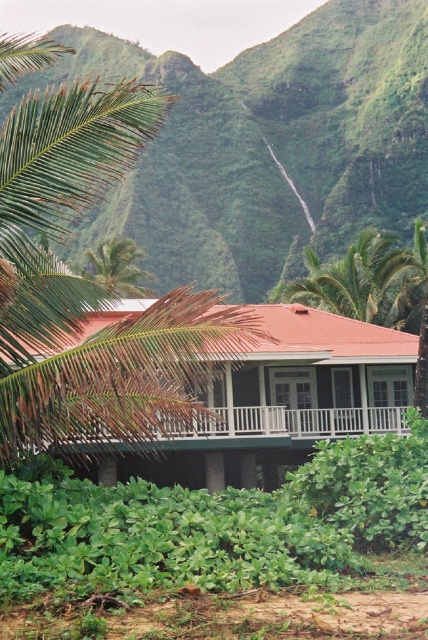
Who is higher up, green wooden house at center or white wooden porch at center?

green wooden house at center is higher up.

Find the location of a particular element. This screenshot has width=428, height=640. green wooden house at center is located at coordinates (285, 401).

Who is more forward, (222,451) or (243,429)?

Point (243,429)

The width and height of the screenshot is (428, 640). I want to click on green wooden house at center, so click(285, 401).

Is green leafy palm tree at center-left thinner than green wooden house at center?

No.

Between point (64, 106) and point (336, 387), which one is positioned in front?

Point (64, 106)

What do you see at coordinates (89, 284) in the screenshot?
I see `green leafy palm tree at center-left` at bounding box center [89, 284].

I want to click on green leafy palm tree at center-left, so click(x=89, y=284).

From the picture: Who is higher up, green leafy palm tree at center-left or white wooden porch at center?

green leafy palm tree at center-left is higher up.

Describe the element at coordinates (89, 284) in the screenshot. I see `green leafy palm tree at center-left` at that location.

Is point (35, 326) positioned in front of point (309, 433)?

Yes, it is.

Locate an element on the screen. The height and width of the screenshot is (640, 428). green leafy palm tree at center-left is located at coordinates (89, 284).